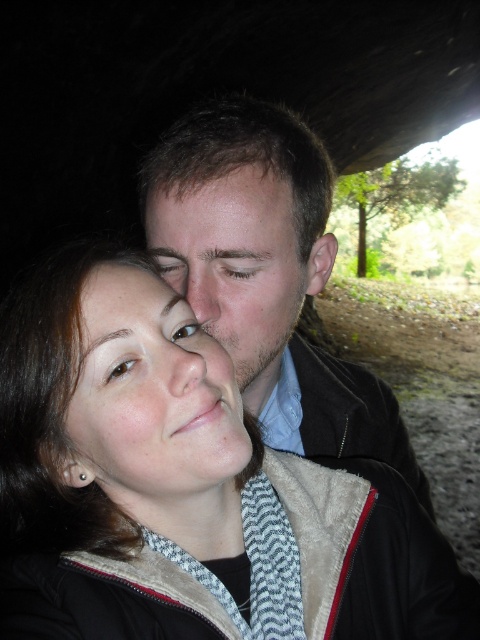
Question: Can you confirm if smooth black jacket at upper center is positioned above smooth skin face at upper center?

Choices:
 (A) yes
 (B) no

Answer: (B)

Question: Which point is farther from the camera taking this photo?

Choices:
 (A) (154, 499)
 (B) (312, 616)
 (C) (170, 234)
 (D) (283, 170)

Answer: (C)

Question: Where is smooth skin face at center located in relation to matte skin at center in the image?

Choices:
 (A) below
 (B) above

Answer: (A)

Question: Which object is the closest to the matte black jacket at lower left?

Choices:
 (A) matte skin at center
 (B) smooth black jacket at upper center
 (C) smooth skin face at upper center
 (D) smooth skin face at center

Answer: (D)

Question: Which is farther from the smooth skin face at upper center?

Choices:
 (A) matte black jacket at lower left
 (B) smooth black jacket at upper center

Answer: (A)

Question: Is matte black jacket at lower left wider than smooth black jacket at upper center?

Choices:
 (A) yes
 (B) no

Answer: (A)